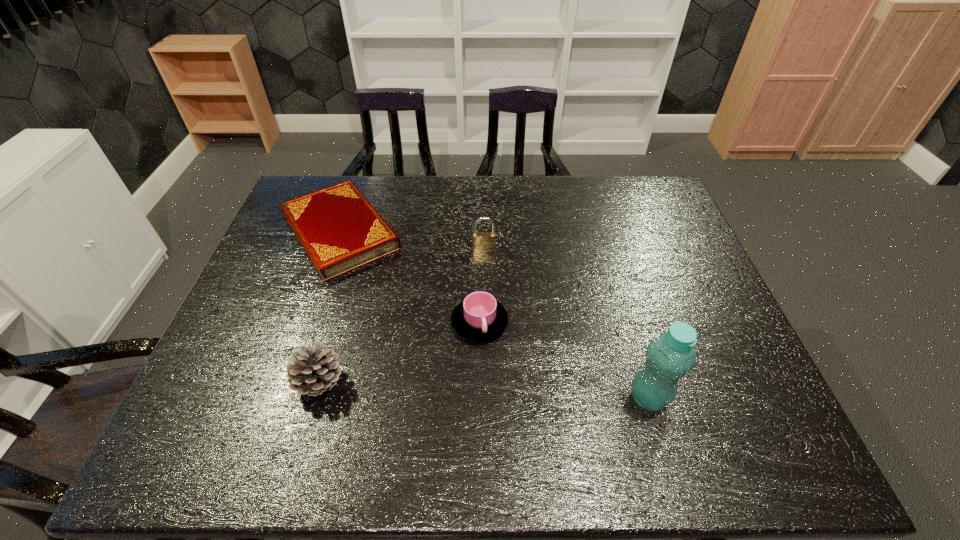
Image resolution: width=960 pixels, height=540 pixels. I want to click on pinecone, so click(x=312, y=372).

Locate an element on the screen. the tallest object is located at coordinates (669, 357).

You are a GUI agent. You are given a task and a screenshot of the screen. Output one action in this format:
    pyautogui.click(x=<x>, y=<y>)
    Task: Click on the water bottle
    This screenshot has width=960, height=540.
    Given the screenshot: What is the action you would take?
    pyautogui.click(x=669, y=357)

Identify the location of the shortest object. tap(339, 230).

I want to click on padlock, so click(481, 241).

At what (x,y) coordinates should I click in order to perform the action: click on the third nearest object. Please return your answer as a coordinate pair (x, y). Looking at the image, I should click on (479, 317).

The width and height of the screenshot is (960, 540). I want to click on cup, so [x=479, y=317].

Where is `free location located on the left of the pinecone`? free location located on the left of the pinecone is located at coordinates (238, 383).

Identify the location of free location located 0.260m on the cover of the shortest object. (410, 334).

Locate an element on the screen. vacant space located 0.080m on the cover of the shortest object is located at coordinates (379, 290).